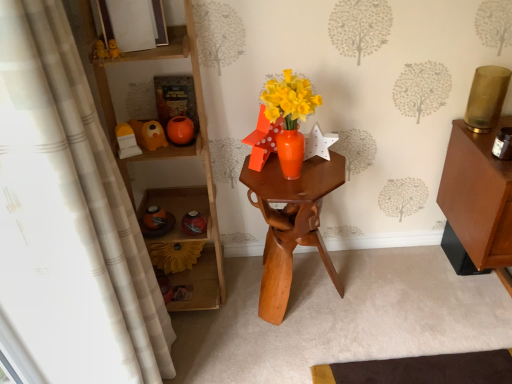
Where is `wooden hexagonal table at center`? wooden hexagonal table at center is located at coordinates (291, 223).

Measure the distance between wooden shelf at left and camera.

wooden shelf at left and camera are 1.33 meters apart.

What do you see at coordinates (133, 24) in the screenshot? I see `matte white picture frame at upper center` at bounding box center [133, 24].

I want to click on wooden hexagonal table at center, so click(291, 223).

From the image's perspective, is matte orange vase at center, arranged as the first toy when viewed from the back, located beneath wooden hexagonal table at center?

Incorrect, from the image's perspective, matte orange vase at center, arranged as the first toy when viewed from the back, is higher than wooden hexagonal table at center.

Is matte orange vase at center, arranged as the first toy when viewed from the back, facing towards wooden hexagonal table at center?

No.

Find the location of a particular element. This screenshot has width=512, height=384. table on the right of matte orange vase at center, arranged as the first toy when viewed from the back is located at coordinates coord(291,223).

Is matte orange vase at center, the second toy from the front, not near wooden hexagonal table at center?

matte orange vase at center, the second toy from the front, is near wooden hexagonal table at center, not far away.

Between wooden hexagonal table at center and wooden shelf at left, which one has more height?

With more height is wooden shelf at left.

From the image's perspective, which object appears higher, wooden hexagonal table at center or wooden shelf at left?

wooden shelf at left is shown above in the image.

From the picture: Could you tell me if wooden hexagonal table at center is facing wooden shelf at left?

No, wooden hexagonal table at center is not aimed at wooden shelf at left.

You are a GUI agent. You are given a task and a screenshot of the screen. Output one action in this format:
    pyautogui.click(x=<x>, y=<y>)
    Task: Click on the shelf above the wooden hexagonal table at center (from the image's perspective)
    
    Given the screenshot: What is the action you would take?
    pyautogui.click(x=178, y=187)

Identify the location of shelf directly beneath the matte orange vase at center, the second toy from the front (from a real-world perspective). This screenshot has height=384, width=512. (178, 187).

From a real-world perspective, is wooden shelf at left on matte orange vase at center, the second toy from the front?

No, from a real-world perspective, wooden shelf at left is not above matte orange vase at center, the second toy from the front.

In the scene shown: Is wooden shelf at left to the left of matte orange vase at center, the second toy from the front, from the viewer's perspective?

Incorrect, wooden shelf at left is not on the left side of matte orange vase at center, the second toy from the front.

Is wooden shelf at left taller or shorter than matte orange vase at center, the second toy from the front?

In the image, wooden shelf at left appears to be taller than matte orange vase at center, the second toy from the front.

Considering the positions of points (163, 19) and (259, 198), is point (163, 19) closer to camera compared to point (259, 198)?

Yes.

From the image's perspective, is matte white picture frame at upper center on wooden hexagonal table at center?

Yes, from the image's perspective, matte white picture frame at upper center is on top of wooden hexagonal table at center.

In the image, is matte white picture frame at upper center positioned in front of or behind wooden hexagonal table at center?

In the image, matte white picture frame at upper center appears in front of wooden hexagonal table at center.

Is matte white picture frame at upper center not within wooden hexagonal table at center?

Yes, matte white picture frame at upper center is located beyond the bounds of wooden hexagonal table at center.

Which object is positioned more to the left, wooden shelf at left or wooden hexagonal table at center?

wooden shelf at left.

From a real-world perspective, does wooden shelf at left sit lower than wooden hexagonal table at center?

Actually, wooden shelf at left is physically above wooden hexagonal table at center in the real world.

Does wooden shelf at left contain wooden hexagonal table at center?

No, wooden hexagonal table at center is not a part of wooden shelf at left.

Is wooden shelf at left beside wooden hexagonal table at center?

No, wooden shelf at left is not next to wooden hexagonal table at center.

Is white textured curtain at left completely or partially outside of matte orange vase at center, the second toy from the front?

white textured curtain at left is positioned outside matte orange vase at center, the second toy from the front.

Does white textured curtain at left appear on the right side of matte orange vase at center, arranged as the first toy when viewed from the back?

No.

Which of these two, white textured curtain at left or matte orange vase at center, arranged as the first toy when viewed from the back, is wider?

With larger width is white textured curtain at left.

Considering the positions of point (16, 234) and point (154, 136), is point (16, 234) closer or farther from the camera than point (154, 136)?

Clearly, point (16, 234) is closer to the camera than point (154, 136).

Which is in front, point (179, 45) or point (123, 134)?

The point (179, 45) is more forward.

Locate an element on the screen. This screenshot has height=384, width=512. shelf on the right of matte yellow plastic toy at left, positioned as the 1th toy in front-to-back order is located at coordinates (178, 187).

Considering the relative sizes of wooden shelf at left and matte yellow plastic toy at left, which is the 2th toy in back-to-front order, in the image provided, is wooden shelf at left wider than matte yellow plastic toy at left, which is the 2th toy in back-to-front order,?

Yes, wooden shelf at left is wider than matte yellow plastic toy at left, which is the 2th toy in back-to-front order.

Find the location of a particular element. The height and width of the screenshot is (384, 512). table on the right of the matte orange vase at center, arranged as the first toy when viewed from the back is located at coordinates (291, 223).

This screenshot has height=384, width=512. Find the location of `table below the wooden shelf at left (from the image's perspective)`. table below the wooden shelf at left (from the image's perspective) is located at coordinates (291, 223).

Estimate the real-world distances between objects in this image. Which object is closer to white textured curtain at left, matte white picture frame at upper center or wooden hexagonal table at center?

wooden hexagonal table at center.

From the picture: Based on their spatial positions, is wooden shelf at left or matte orange vase at center, the second toy from the front, further from white textured curtain at left?

matte orange vase at center, the second toy from the front, is further to white textured curtain at left.

Estimate the real-world distances between objects in this image. Which object is closer to matte orange vase at center, arranged as the first toy when viewed from the back, matte yellow plastic toy at left, which is the 2th toy in back-to-front order, or wooden shelf at left?

Among the two, matte yellow plastic toy at left, which is the 2th toy in back-to-front order, is located nearer to matte orange vase at center, arranged as the first toy when viewed from the back.

Estimate the real-world distances between objects in this image. Which object is further from matte orange vase at center, the second toy from the front, matte white picture frame at upper center or white textured curtain at left?

The object further to matte orange vase at center, the second toy from the front, is white textured curtain at left.

Considering their positions, is matte yellow plastic toy at left, which is the 2th toy in back-to-front order, positioned further to wooden shelf at left than matte white picture frame at upper center?

Among the two, matte white picture frame at upper center is located further to wooden shelf at left.

Considering their positions, is matte yellow plastic toy at left, which is the 2th toy in back-to-front order, positioned further to matte white picture frame at upper center than wooden hexagonal table at center?

wooden hexagonal table at center lies further to matte white picture frame at upper center than the other object.

Considering their positions, is white textured curtain at left positioned closer to matte yellow plastic toy at left, positioned as the 1th toy in front-to-back order, than wooden hexagonal table at center?

white textured curtain at left.

Looking at the image, which one is located closer to matte white picture frame at upper center, matte yellow plastic toy at left, positioned as the 1th toy in front-to-back order, or matte orange vase at center, arranged as the first toy when viewed from the back?

Among the two, matte orange vase at center, arranged as the first toy when viewed from the back, is located nearer to matte white picture frame at upper center.

Find the location of `toy positioned between wooden shelf at left and matte orange vase at center, the second toy from the front, from near to far`. toy positioned between wooden shelf at left and matte orange vase at center, the second toy from the front, from near to far is located at coordinates (126, 141).

The image size is (512, 384). Find the location of `table between white textured curtain at left and matte yellow plastic toy at left, which is the 2th toy in back-to-front order, in the front-back direction`. table between white textured curtain at left and matte yellow plastic toy at left, which is the 2th toy in back-to-front order, in the front-back direction is located at coordinates (291, 223).

Identify the location of shelf between matte orange vase at center, arranged as the first toy when viewed from the back, and wooden hexagonal table at center, in the horizontal direction. The height and width of the screenshot is (384, 512). (178, 187).

Identify the location of toy between matte white picture frame at upper center and matte yellow plastic toy at left, which is the 2th toy in back-to-front order, in the up-down direction. (149, 134).